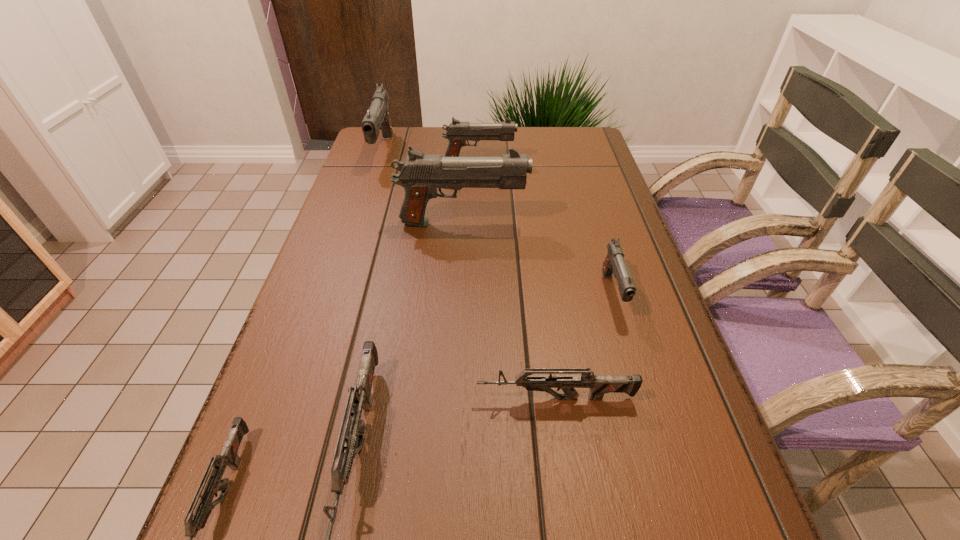
The height and width of the screenshot is (540, 960). Find the location of `vacant region located 0.240m in the direction the tallest gun is aimed`. vacant region located 0.240m in the direction the tallest gun is aimed is located at coordinates (621, 223).

Locate an element on the screen. vacant space located in the direction the leftmost gray gun is aimed is located at coordinates (348, 260).

The height and width of the screenshot is (540, 960). Identify the location of vacant space positioned 0.100m in the direction the fifth shortest object is aimed. (548, 162).

Locate an element on the screen. The width and height of the screenshot is (960, 540). free region located 0.210m in the direction the rightmost gun is aimed is located at coordinates (650, 419).

What are the coordinates of `free space located aimed along the barrel of the second smallest grey gun` in the screenshot? It's located at (401, 399).

At what (x,y) coordinates should I click in order to perform the action: click on free space located aimed along the barrel of the second smallest grey gun. Please return your answer as a coordinate pair (x, y). The height and width of the screenshot is (540, 960). Looking at the image, I should click on (279, 399).

Find the location of a particular element. free region located 0.270m aimed along the barrel of the second smallest grey gun is located at coordinates (320, 399).

Find the location of a particular element. object that is at the left edge is located at coordinates (377, 118).

The height and width of the screenshot is (540, 960). In order to click on object present at the far left corner in this screenshot , I will do `click(377, 118)`.

Locate an element on the screen. The height and width of the screenshot is (540, 960). free space at the far edge is located at coordinates click(431, 153).